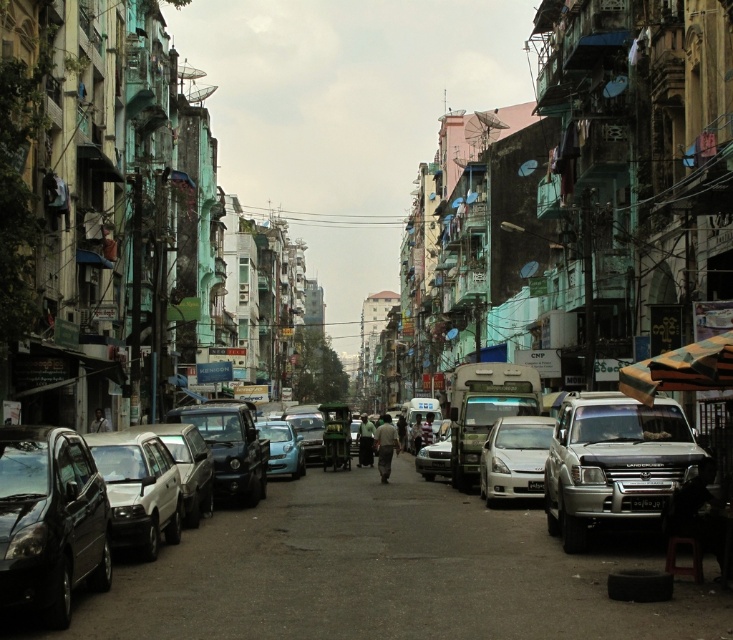
Which of these two, shiny black car at center or light brown fabric pants at center, stands taller?

shiny black car at center

Identify the location of shiny black car at center. Image resolution: width=733 pixels, height=640 pixels. (229, 448).

Looking at this image, which is more to the right, silver metallic suv at right or matte black car at left?

silver metallic suv at right is more to the right.

Can you confirm if silver metallic suv at right is bigger than matte black car at left?

Actually, silver metallic suv at right might be smaller than matte black car at left.

Is point (570, 404) farther from camera compared to point (174, 528)?

Yes, it is behind point (174, 528).

This screenshot has height=640, width=733. I want to click on silver metallic suv at right, so click(x=611, y=460).

Who is positioned more to the right, matte black car at left or satin silver sedan at center?

Positioned to the right is satin silver sedan at center.

Consider the image. Is matte black car at left to the left of satin silver sedan at center from the viewer's perspective?

Yes, matte black car at left is to the left of satin silver sedan at center.

The image size is (733, 640). What do you see at coordinates (139, 488) in the screenshot? I see `matte black car at left` at bounding box center [139, 488].

Where is `matte black car at left`? Image resolution: width=733 pixels, height=640 pixels. matte black car at left is located at coordinates (139, 488).